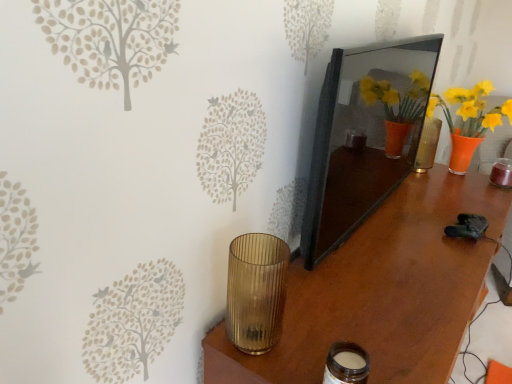
The height and width of the screenshot is (384, 512). I want to click on vacant area that is situated to the right of matte glass jar at lower center, which appears as the second candle holder when viewed from the left, so click(x=408, y=359).